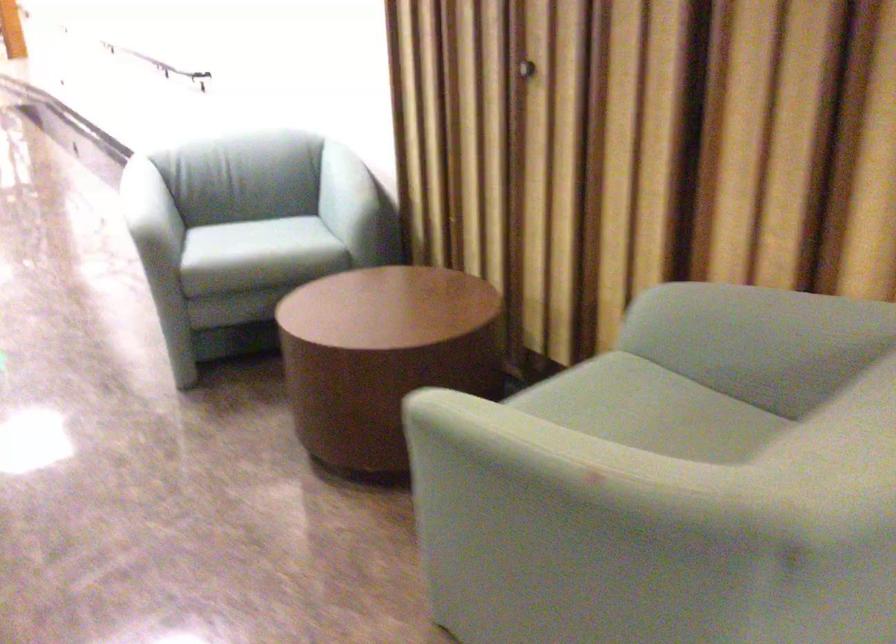
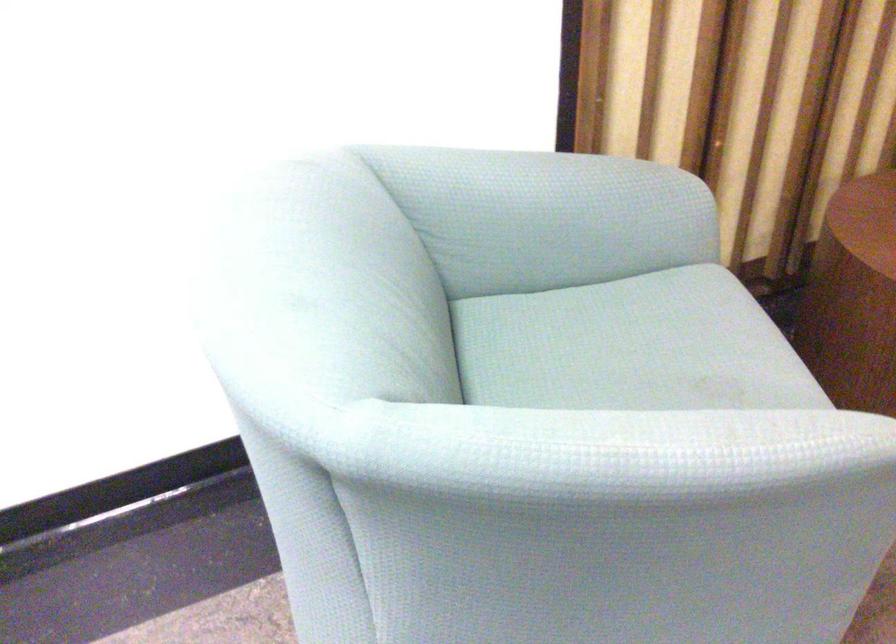
The point at (x=333, y=185) is marked in the first image. Where is the corresponding point in the second image?

(545, 216)